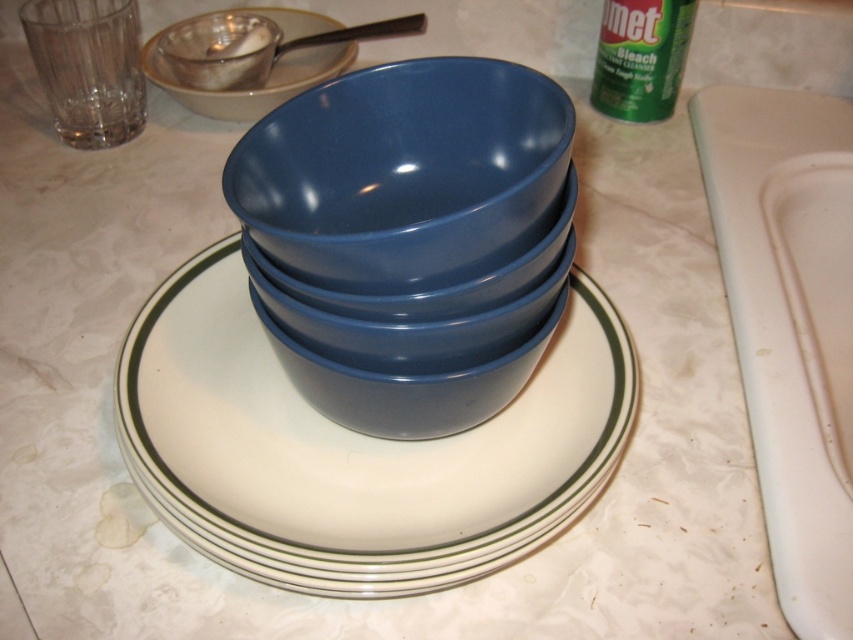
Can you confirm if matte blue bowl at center is positioned below matte ceramic saucer at upper left?

Yes.

Does matte blue bowl at center appear over matte ceramic saucer at upper left?

Incorrect, matte blue bowl at center is not positioned above matte ceramic saucer at upper left.

The height and width of the screenshot is (640, 853). What do you see at coordinates (404, 173) in the screenshot? I see `matte blue bowl at center` at bounding box center [404, 173].

Locate an element on the screen. The height and width of the screenshot is (640, 853). matte blue bowl at center is located at coordinates (404, 173).

Which is in front, point (341, 435) or point (340, 97)?

Point (340, 97) is in front.

How much distance is there between white glossy platter at center and matte blue bowl at center?

5.74 inches

The image size is (853, 640). I want to click on white glossy platter at center, so click(x=355, y=449).

The width and height of the screenshot is (853, 640). Find the location of `white glossy platter at center`. white glossy platter at center is located at coordinates (355, 449).

Does white glossy platter at center come in front of matte ceramic saucer at upper left?

Yes, white glossy platter at center is closer to the viewer.

From the picture: Is white glossy platter at center to the right of matte ceramic saucer at upper left from the viewer's perspective?

Indeed, white glossy platter at center is positioned on the right side of matte ceramic saucer at upper left.

Locate an element on the screen. white glossy platter at center is located at coordinates (355, 449).